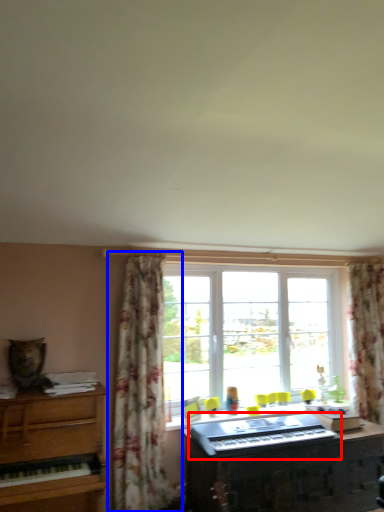
Question: Which of the following is the closest to the observer, musical keyboard (highlighted by a red box) or curtain (highlighted by a blue box)?

Choices:
 (A) musical keyboard
 (B) curtain

Answer: (A)